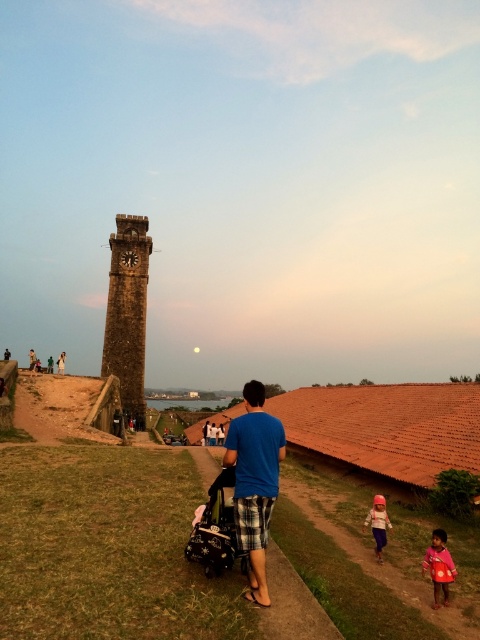
Question: Which object appears closest to the camera in this image?

Choices:
 (A) pink fabric dress at lower right
 (B) stone clock tower at left

Answer: (A)

Question: Is pink fabric dress at lower right positioned in front of blue plaid shorts at center?

Choices:
 (A) yes
 (B) no

Answer: (A)

Question: Which point is farther to the camera?

Choices:
 (A) pink fabric child at lower right
 (B) pink fabric dress at lower right

Answer: (B)

Question: Does pink fabric child at lower right appear on the right side of pink fabric dress at lower right?

Choices:
 (A) no
 (B) yes

Answer: (B)

Question: Among these points, which one is nearest to the camera?

Choices:
 (A) (252, 552)
 (B) (429, 563)

Answer: (A)

Question: Can you confirm if blue cotton shirt at center is positioned above stone clock tower at left?

Choices:
 (A) yes
 (B) no

Answer: (B)